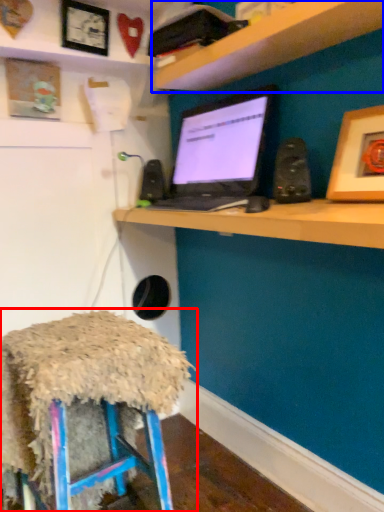
Question: Among these objects, which one is farthest to the camera, stool (highlighted by a red box) or shelf (highlighted by a blue box)?

Choices:
 (A) stool
 (B) shelf

Answer: (A)